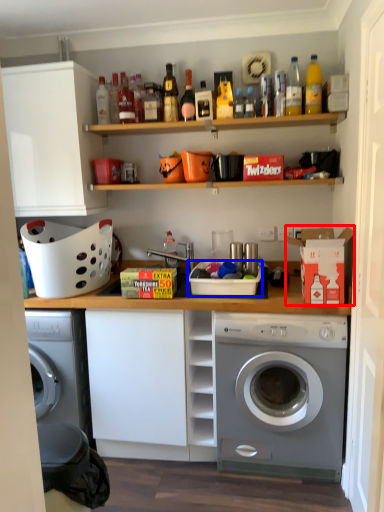
Question: Which object is closer to the camera taking this photo, cardboard box (highlighted by a red box) or basket (highlighted by a blue box)?

Choices:
 (A) cardboard box
 (B) basket

Answer: (A)